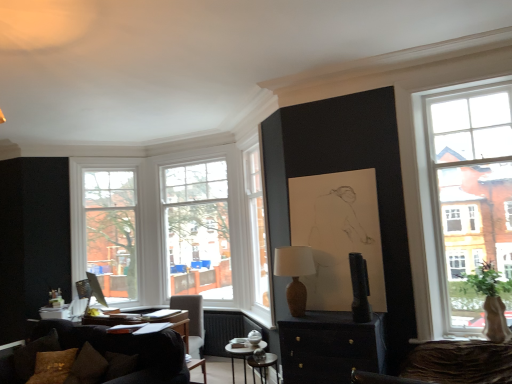
Question: Can you confirm if matte brown vase at center is shorter than metallic silver side table at center?

Choices:
 (A) no
 (B) yes

Answer: (A)

Question: Does matte brown vase at center have a lesser width compared to metallic silver side table at center?

Choices:
 (A) yes
 (B) no

Answer: (A)

Question: Considering the relative sizes of matte brown vase at center and metallic silver side table at center in the image provided, is matte brown vase at center taller than metallic silver side table at center?

Choices:
 (A) yes
 (B) no

Answer: (A)

Question: Does matte brown vase at center turn towards metallic silver side table at center?

Choices:
 (A) no
 (B) yes

Answer: (A)

Question: Is matte brown vase at center positioned far away from metallic silver side table at center?

Choices:
 (A) no
 (B) yes

Answer: (B)

Question: Considering their positions, is brown textured pillow at lower left located in front of or behind dark brown leather chair at center?

Choices:
 (A) behind
 (B) front

Answer: (B)

Question: From a real-world perspective, is brown textured pillow at lower left above or below dark brown leather chair at center?

Choices:
 (A) above
 (B) below

Answer: (A)

Question: From the image's perspective, is brown textured pillow at lower left located above or below dark brown leather chair at center?

Choices:
 (A) above
 (B) below

Answer: (A)

Question: Would you say brown textured pillow at lower left is inside or outside dark brown leather chair at center?

Choices:
 (A) outside
 (B) inside

Answer: (A)

Question: From a real-world perspective, is dark brown leather chair at center positioned above or below clear glass window at center, which ranks as the 1th window in right-to-left order?

Choices:
 (A) above
 (B) below

Answer: (B)

Question: In the image, is dark brown leather chair at center on the left side or the right side of clear glass window at center, which ranks as the 1th window in right-to-left order?

Choices:
 (A) left
 (B) right

Answer: (A)

Question: Is point (170, 304) positioned closer to the camera than point (225, 190)?

Choices:
 (A) farther
 (B) closer

Answer: (B)

Question: In the image, is dark brown leather chair at center positioned in front of or behind clear glass window at center, which is the 2th window from left to right?

Choices:
 (A) behind
 (B) front

Answer: (B)

Question: Is matte black cabinet at center bigger or smaller than dark brown leather chair at center?

Choices:
 (A) big
 (B) small

Answer: (B)

Question: In terms of width, does matte black cabinet at center look wider or thinner when compared to dark brown leather chair at center?

Choices:
 (A) thin
 (B) wide

Answer: (A)